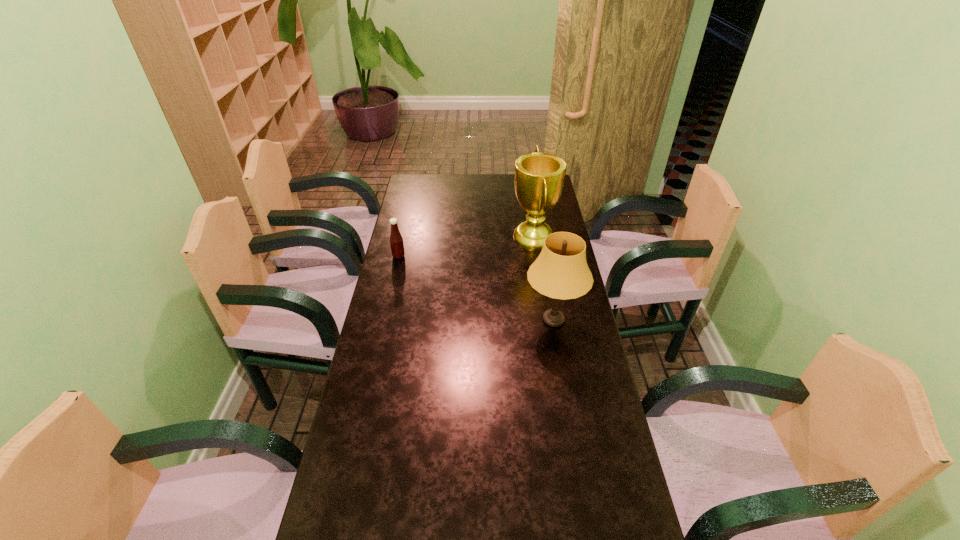
In order to click on free region that satisfies the following two spatial constraints: 1. on the front side of the Tabasco sauce; 2. on the left side of the nearest object in this screenshot , I will do `click(385, 320)`.